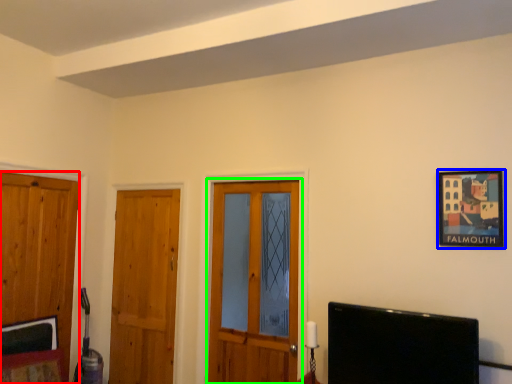
Question: Based on their relative distances, which object is farther from door (highlighted by a red box)? Choose from picture frame (highlighted by a blue box) and door (highlighted by a green box).

Choices:
 (A) picture frame
 (B) door

Answer: (A)